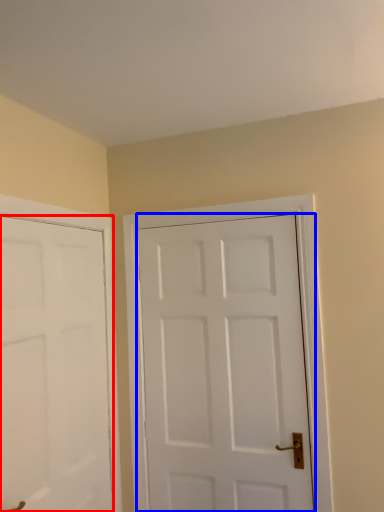
Question: Which object is further to the camera taking this photo, door (highlighted by a red box) or door (highlighted by a blue box)?

Choices:
 (A) door
 (B) door

Answer: (B)